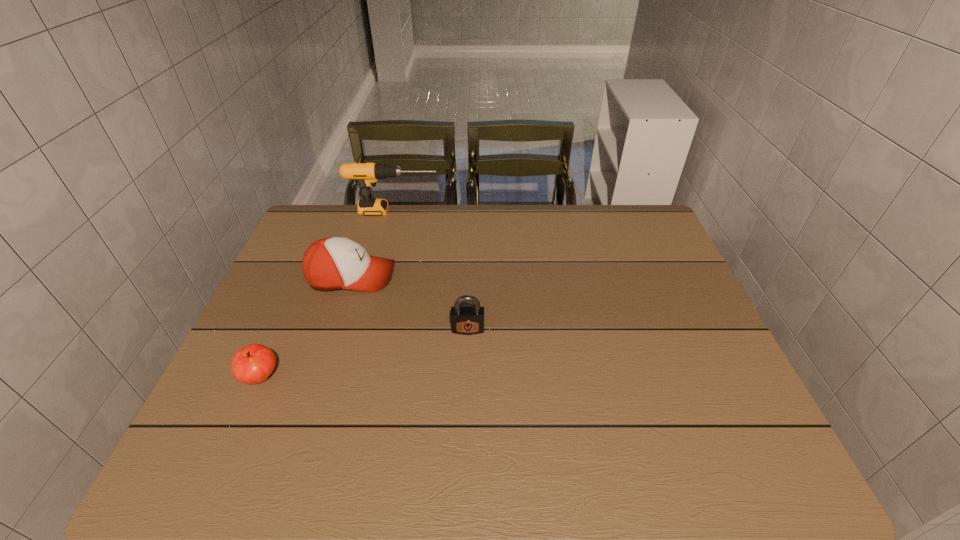
Find the location of a particular element. This screenshot has width=960, height=540. free space located on the front of the shortest object is located at coordinates (236, 432).

Image resolution: width=960 pixels, height=540 pixels. I want to click on object situated at the far edge, so click(x=367, y=174).

Find the location of a particular element. The width and height of the screenshot is (960, 540). drill positioned at the left edge is located at coordinates click(367, 174).

This screenshot has width=960, height=540. In order to click on baseball cap that is at the left edge in this screenshot , I will do `click(332, 263)`.

Locate an element on the screen. The width and height of the screenshot is (960, 540). apple at the left edge is located at coordinates (252, 364).

Locate an element on the screen. The image size is (960, 540). object located at the far left corner is located at coordinates (367, 174).

Locate an element on the screen. The height and width of the screenshot is (540, 960). vacant space at the far edge of the desktop is located at coordinates (595, 245).

This screenshot has width=960, height=540. I want to click on free space at the near edge of the desktop, so click(x=603, y=438).

In order to click on free space at the left edge of the desktop in this screenshot , I will do `click(293, 314)`.

In the image, there is a desktop. Identify the location of vacant space at the right edge. Image resolution: width=960 pixels, height=540 pixels. (666, 323).